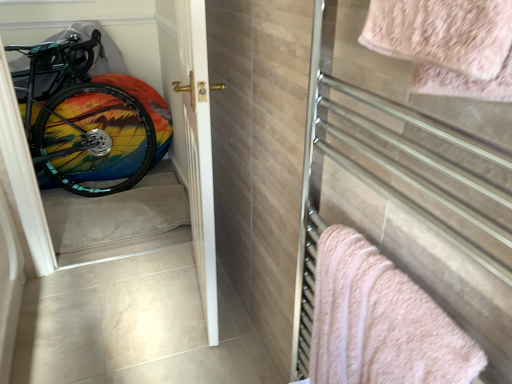
Measure the distance between rainbow painted bicycle wheel at left and camera.

rainbow painted bicycle wheel at left is 2.32 meters from camera.

Describe the element at coordinates (115, 217) in the screenshot. This screenshot has height=384, width=512. I see `carpeted stairwell at left` at that location.

What is the approximate height of metallic towel rack at right?

The height of metallic towel rack at right is 3.66 feet.

Where is `rainbow painted bicycle wheel at left`? rainbow painted bicycle wheel at left is located at coordinates (82, 120).

Which object is positioned more to the right, carpeted stairwell at left or pink fluffy towel at right, which is the first towel from bottom to top?

pink fluffy towel at right, which is the first towel from bottom to top.

Based on the photo, how many degrees apart are the facing directions of carpeted stairwell at left and pink fluffy towel at right, which is the first towel from bottom to top?

The facing directions of carpeted stairwell at left and pink fluffy towel at right, which is the first towel from bottom to top, are 91.4 degrees apart.

Which object is wider, carpeted stairwell at left or pink fluffy towel at right, which ranks as the 2th towel in top-to-bottom order?

carpeted stairwell at left is wider.

Is carpeted stairwell at left situated inside pink fluffy towel at right, which is the first towel from bottom to top, or outside?

carpeted stairwell at left is outside pink fluffy towel at right, which is the first towel from bottom to top.

What's the angular difference between white glossy door at center and pink fluffy towel at right, acting as the 1th towel starting from the back,'s facing directions?

6.67 degrees.

Image resolution: width=512 pixels, height=384 pixels. I want to click on the 1st towel counting from the right side of the white glossy door at center, so click(x=380, y=322).

Considering the relative positions of white glossy door at center and pink fluffy towel at right, acting as the 1th towel starting from the back, in the image provided, is white glossy door at center to the left or to the right of pink fluffy towel at right, acting as the 1th towel starting from the back,?

Based on their positions, white glossy door at center is located to the left of pink fluffy towel at right, acting as the 1th towel starting from the back.

Does white glossy door at center have a greater width compared to pink fluffy towel at right, which ranks as the 2th towel in top-to-bottom order?

Correct, the width of white glossy door at center exceeds that of pink fluffy towel at right, which ranks as the 2th towel in top-to-bottom order.

Measure the distance between pink fluffy towel at upper right, which ranks as the second towel in back-to-front order, and rainbow painted bicycle wheel at left.

pink fluffy towel at upper right, which ranks as the second towel in back-to-front order, is 7.72 feet from rainbow painted bicycle wheel at left.

Identify the location of bicycle that is behind the pink fluffy towel at upper right, which ranks as the second towel in back-to-front order. Image resolution: width=512 pixels, height=384 pixels. click(82, 120).

Can you tell me how much pink fluffy towel at upper right, the second towel in the bottom-to-top sequence, and rainbow painted bicycle wheel at left differ in facing direction?

The angle between the facing direction of pink fluffy towel at upper right, the second towel in the bottom-to-top sequence, and the facing direction of rainbow painted bicycle wheel at left is 90.5 degrees.

From the image's perspective, would you say pink fluffy towel at upper right, the first towel in the top-to-bottom sequence, is positioned over rainbow painted bicycle wheel at left?

No, from the image's perspective, pink fluffy towel at upper right, the first towel in the top-to-bottom sequence, is not over rainbow painted bicycle wheel at left.

Considering the relative sizes of pink fluffy towel at right, which is the 2th towel in front-to-back order, and rainbow painted bicycle wheel at left in the image provided, is pink fluffy towel at right, which is the 2th towel in front-to-back order, smaller than rainbow painted bicycle wheel at left?

Correct, pink fluffy towel at right, which is the 2th towel in front-to-back order, occupies less space than rainbow painted bicycle wheel at left.

Can rainbow painted bicycle wheel at left be found inside pink fluffy towel at right, which ranks as the 2th towel in top-to-bottom order?

No, pink fluffy towel at right, which ranks as the 2th towel in top-to-bottom order, does not contain rainbow painted bicycle wheel at left.

Does point (365, 286) appear closer or farther from the camera than point (62, 112)?

Clearly, point (365, 286) is closer to the camera than point (62, 112).

In the scene shown: Is pink fluffy towel at upper right, the first towel in the top-to-bottom sequence, oriented away from metallic towel rack at right?

No, pink fluffy towel at upper right, the first towel in the top-to-bottom sequence, is not facing away from metallic towel rack at right.

From a real-world perspective, is pink fluffy towel at upper right, which ranks as the second towel in back-to-front order, above or below metallic towel rack at right?

pink fluffy towel at upper right, which ranks as the second towel in back-to-front order, is above metallic towel rack at right.

Which point is more distant from viewer, (401, 30) or (395, 208)?

Point (395, 208)

Between pink fluffy towel at upper right, acting as the 1th towel starting from the front, and metallic towel rack at right, which one has smaller width?

metallic towel rack at right.

Is white glossy door at center far from pink fluffy towel at upper right, which ranks as the second towel in back-to-front order?

No, there isn't a large distance between white glossy door at center and pink fluffy towel at upper right, which ranks as the second towel in back-to-front order.

From a real-world perspective, relative to pink fluffy towel at upper right, the second towel in the bottom-to-top sequence, is white glossy door at center vertically above or below?

white glossy door at center is situated lower than pink fluffy towel at upper right, the second towel in the bottom-to-top sequence, in the real world.

In order to click on the 2nd towel in front of the white glossy door at center, starting your count from the anchor in this screenshot , I will do `click(442, 33)`.

Considering the sizes of white glossy door at center and pink fluffy towel at upper right, the second towel in the bottom-to-top sequence, in the image, is white glossy door at center bigger or smaller than pink fluffy towel at upper right, the second towel in the bottom-to-top sequence,?

Considering their sizes, white glossy door at center takes up more space than pink fluffy towel at upper right, the second towel in the bottom-to-top sequence.

Who is smaller, carpeted stairwell at left or white glossy door at center?

Smaller between the two is carpeted stairwell at left.

Between carpeted stairwell at left and white glossy door at center, which one appears on the right side from the viewer's perspective?

white glossy door at center.

Looking at this image, does carpeted stairwell at left have a lesser width compared to white glossy door at center?

No.

Is carpeted stairwell at left shorter than white glossy door at center?

Correct, carpeted stairwell at left is not as tall as white glossy door at center.

This screenshot has width=512, height=384. What are the coordinates of `stairwell below the pink fluffy towel at right, which is the 2th towel in front-to-back order (from a real-world perspective)` in the screenshot? It's located at (115, 217).

In order to click on door above the pink fluffy towel at right, which is the 2th towel in front-to-back order (from the image's perspective) in this screenshot , I will do `click(192, 134)`.

Which object lies nearer to the anchor point metallic towel rack at right, pink fluffy towel at upper right, which ranks as the second towel in back-to-front order, or rainbow painted bicycle wheel at left?

The object closer to metallic towel rack at right is pink fluffy towel at upper right, which ranks as the second towel in back-to-front order.

Based on their spatial positions, is pink fluffy towel at upper right, the first towel in the top-to-bottom sequence, or carpeted stairwell at left closer to rainbow painted bicycle wheel at left?

Based on the image, carpeted stairwell at left appears to be nearer to rainbow painted bicycle wheel at left.

Estimate the real-world distances between objects in this image. Which object is closer to pink fluffy towel at right, which is the first towel from bottom to top, rainbow painted bicycle wheel at left or pink fluffy towel at upper right, the second towel in the bottom-to-top sequence?

Based on the image, pink fluffy towel at upper right, the second towel in the bottom-to-top sequence, appears to be nearer to pink fluffy towel at right, which is the first towel from bottom to top.

Based on their spatial positions, is pink fluffy towel at right, which is the first towel from bottom to top, or metallic towel rack at right further from carpeted stairwell at left?

Among the two, pink fluffy towel at right, which is the first towel from bottom to top, is located further to carpeted stairwell at left.

Estimate the real-world distances between objects in this image. Which object is further from rainbow painted bicycle wheel at left, carpeted stairwell at left or pink fluffy towel at upper right, the second towel in the bottom-to-top sequence?

pink fluffy towel at upper right, the second towel in the bottom-to-top sequence, is further to rainbow painted bicycle wheel at left.

From the image, which object appears to be nearer to metallic towel rack at right, pink fluffy towel at right, which is the first towel from bottom to top, or white glossy door at center?

pink fluffy towel at right, which is the first towel from bottom to top.

Consider the image. Considering their positions, is pink fluffy towel at right, which is the first towel from bottom to top, positioned further to rainbow painted bicycle wheel at left than metallic towel rack at right?

Among the two, pink fluffy towel at right, which is the first towel from bottom to top, is located further to rainbow painted bicycle wheel at left.

Estimate the real-world distances between objects in this image. Which object is closer to pink fluffy towel at right, which is the 2th towel in front-to-back order, rainbow painted bicycle wheel at left or metallic towel rack at right?

Based on the image, metallic towel rack at right appears to be nearer to pink fluffy towel at right, which is the 2th towel in front-to-back order.

The width and height of the screenshot is (512, 384). In order to click on towel located between metallic towel rack at right and carpeted stairwell at left in the depth direction in this screenshot , I will do `click(380, 322)`.

I want to click on towel positioned between metallic towel rack at right and white glossy door at center from near to far, so (x=380, y=322).

This screenshot has width=512, height=384. What are the coordinates of `door located between pink fluffy towel at right, which is the first towel from bottom to top, and carpeted stairwell at left in the depth direction` in the screenshot? It's located at (192, 134).

Locate an element on the screen. Image resolution: width=512 pixels, height=384 pixels. stairwell located between pink fluffy towel at upper right, the second towel in the bottom-to-top sequence, and rainbow painted bicycle wheel at left in the depth direction is located at coordinates (115, 217).